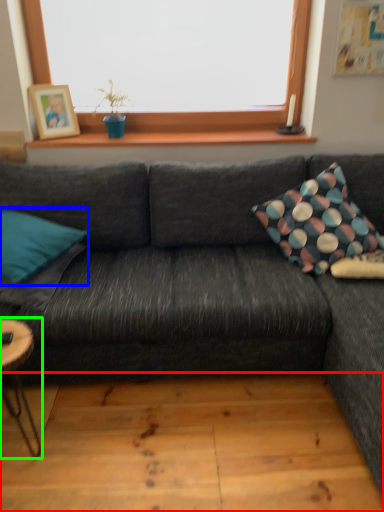
Question: Considering the real-world distances, which object is farthest from plank (highlighted by a red box)? pillow (highlighted by a blue box) or coffee table (highlighted by a green box)?

Choices:
 (A) pillow
 (B) coffee table

Answer: (A)